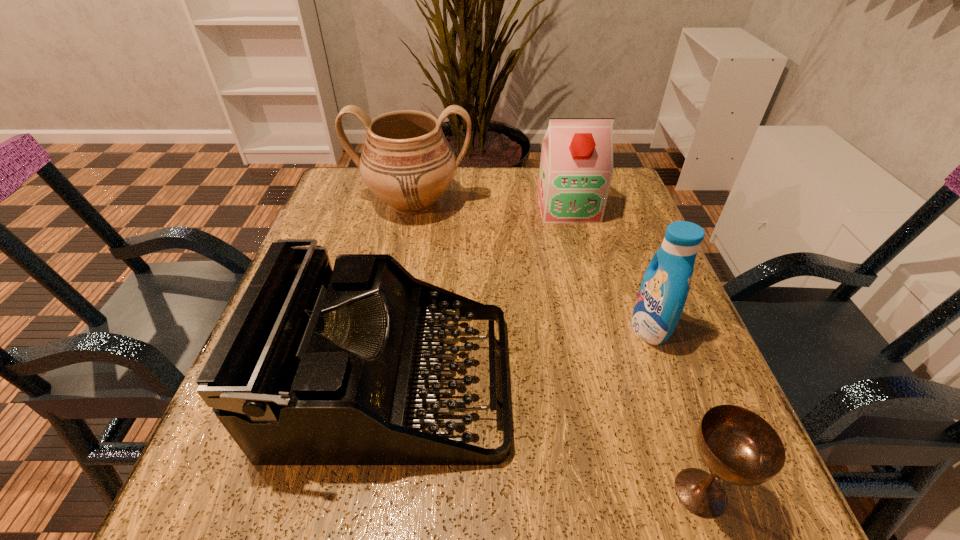
Where is `urn`? urn is located at coordinates (407, 162).

At what (x,y) coordinates should I click in order to perform the action: click on soya milk. Please return your answer as a coordinate pair (x, y). Looking at the image, I should click on (576, 167).

This screenshot has width=960, height=540. I want to click on detergent, so click(x=662, y=295).

Locate an element on the screen. the second shortest object is located at coordinates (316, 366).

The width and height of the screenshot is (960, 540). What are the coordinates of `chalice` in the screenshot? It's located at (737, 445).

The width and height of the screenshot is (960, 540). In order to click on vacant space located 0.080m on the front-facing side of the urn in this screenshot , I will do `click(403, 252)`.

What are the coordinates of `vacant space located with the cap open on the soya milk` in the screenshot? It's located at (588, 285).

Image resolution: width=960 pixels, height=540 pixels. I want to click on free space located on the front-facing side of the detergent, so click(446, 327).

At what (x,y) coordinates should I click in order to perform the action: click on vacant space located on the front-facing side of the detergent. Please return your answer as a coordinate pair (x, y). This screenshot has height=540, width=960. Looking at the image, I should click on (495, 327).

Find the location of `vacant space located on the front-facing side of the detergent`. vacant space located on the front-facing side of the detergent is located at coordinates (606, 327).